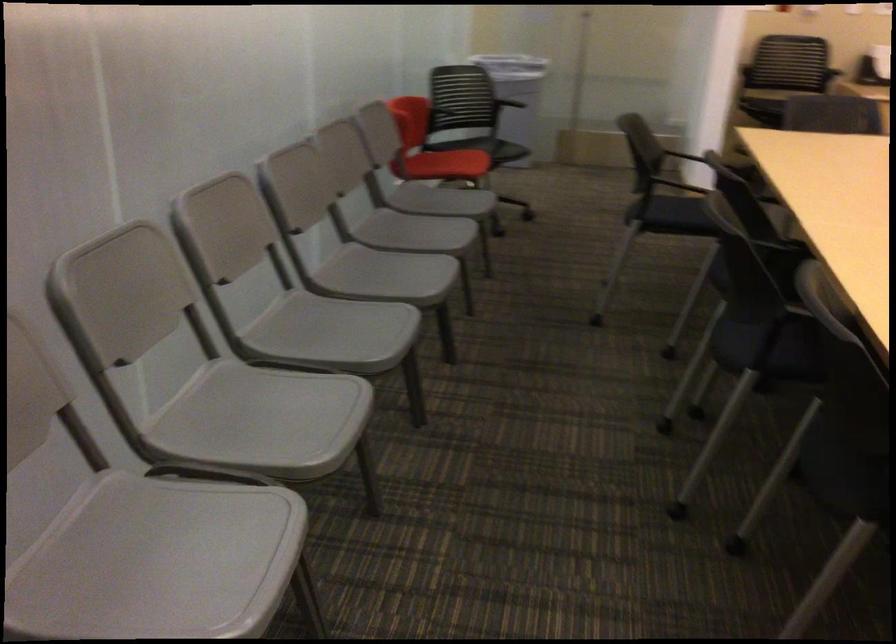
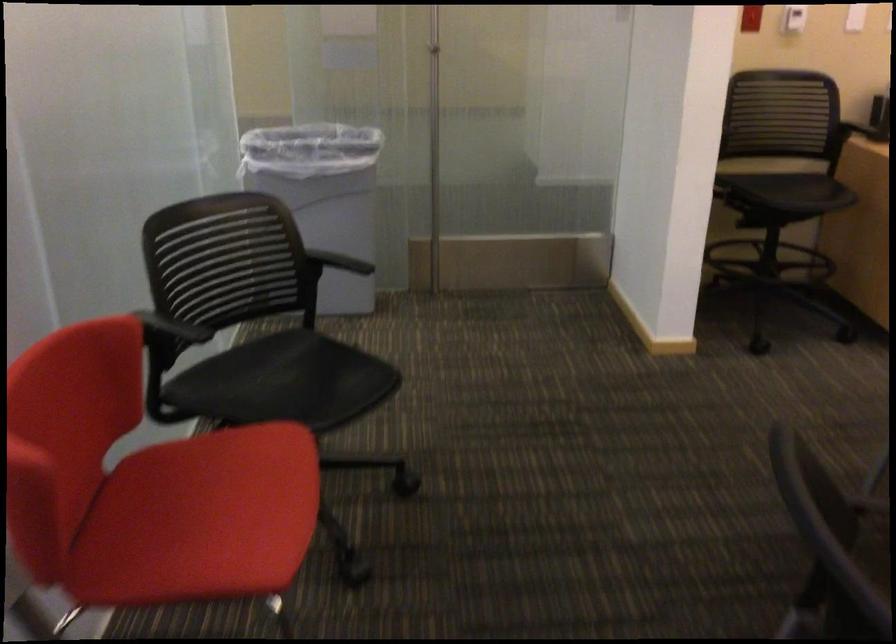
Find the pixel in the second image that matches the point at 765,108 in the first image.

(721, 202)